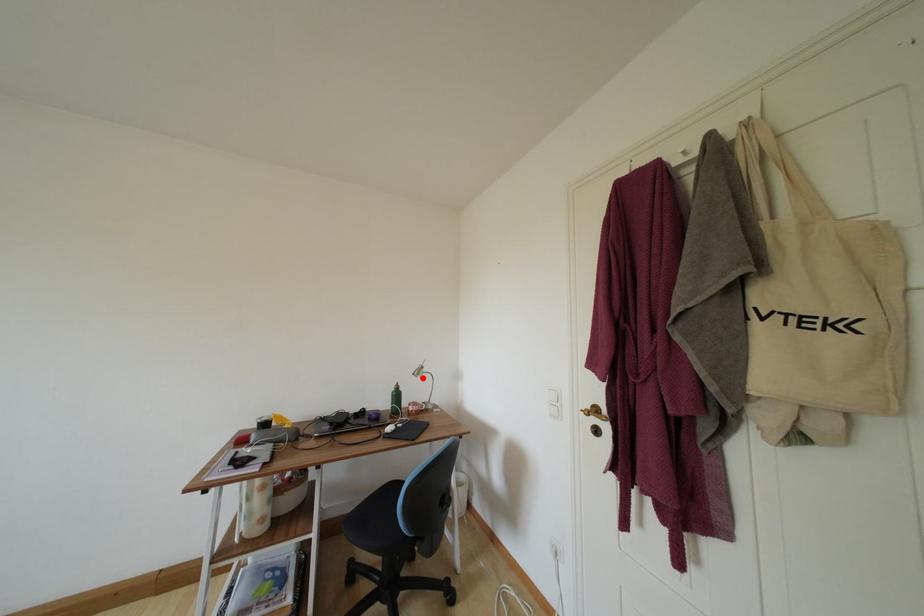
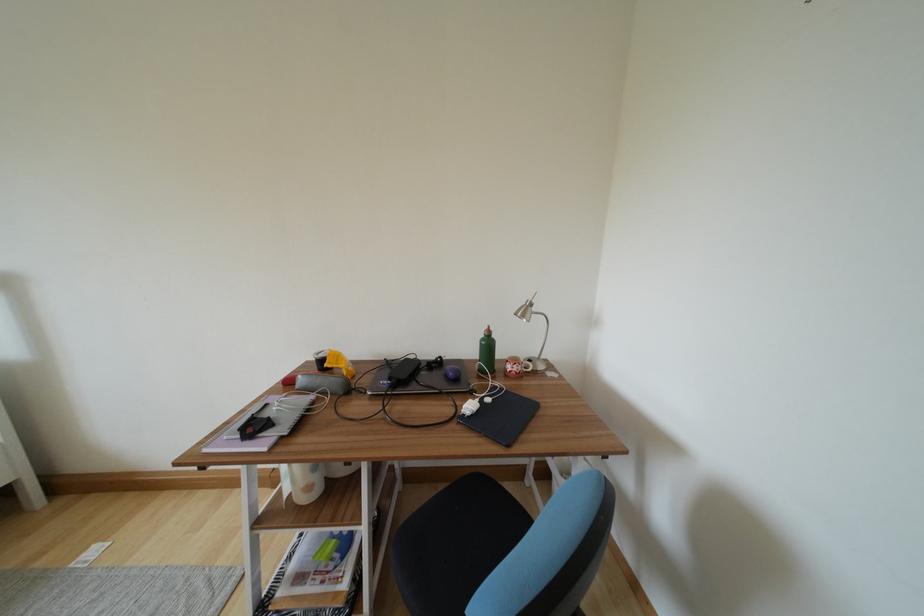
Locate, in the second image, the point that corresponds to the highlighted location in the first image.

(528, 320)